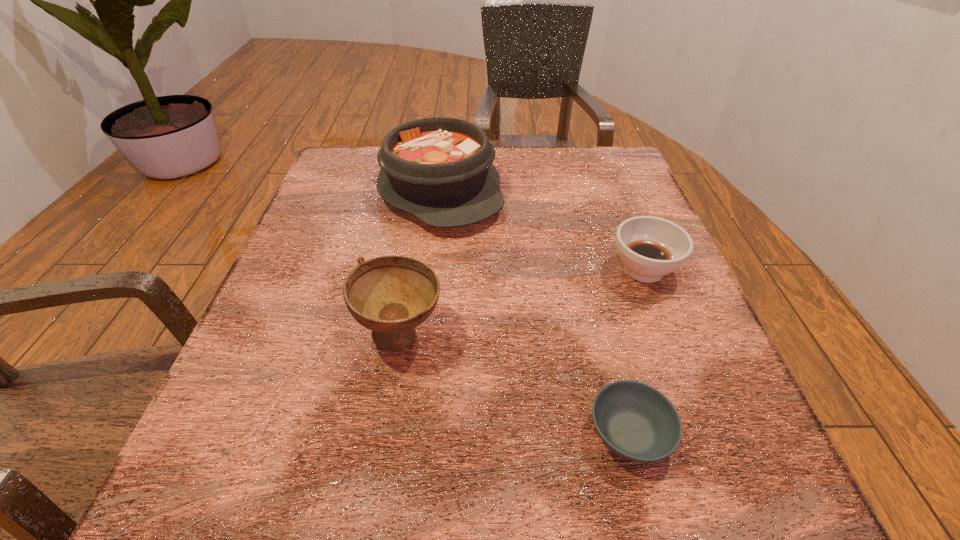
Where is `the farthest object`? The image size is (960, 540). the farthest object is located at coordinates (439, 169).

Image resolution: width=960 pixels, height=540 pixels. I want to click on the second nearest soup bowl, so click(391, 295).

Locate an element on the screen. The width and height of the screenshot is (960, 540). the tallest soup bowl is located at coordinates (391, 295).

You are a GUI agent. You are given a task and a screenshot of the screen. Output one action in this format:
    pyautogui.click(x=<x>, y=<y>)
    Task: Click on the farthest soup bowl
    The height and width of the screenshot is (540, 960).
    Given the screenshot: What is the action you would take?
    pyautogui.click(x=650, y=247)

Find the location of a particular element. The height and width of the screenshot is (540, 960). the second tallest soup bowl is located at coordinates (650, 247).

Locate an element on the screen. the nearest soup bowl is located at coordinates (636, 421).

This screenshot has height=540, width=960. Identify the location of the shortest soup bowl. (636, 421).

You are a GUI agent. You are given a task and a screenshot of the screen. Output one action in this format:
    pyautogui.click(x=<x>, y=<y>)
    Task: Click on the free point located 0.090m on the left of the farthest object
    The height and width of the screenshot is (540, 960).
    Given the screenshot: What is the action you would take?
    pyautogui.click(x=338, y=190)

Locate an element on the screen. The width and height of the screenshot is (960, 540). free space located 0.100m on the front of the tallest soup bowl is located at coordinates (385, 433).

Locate an element on the screen. The height and width of the screenshot is (540, 960). vacant region located on the left of the second shortest object is located at coordinates pos(482,269).